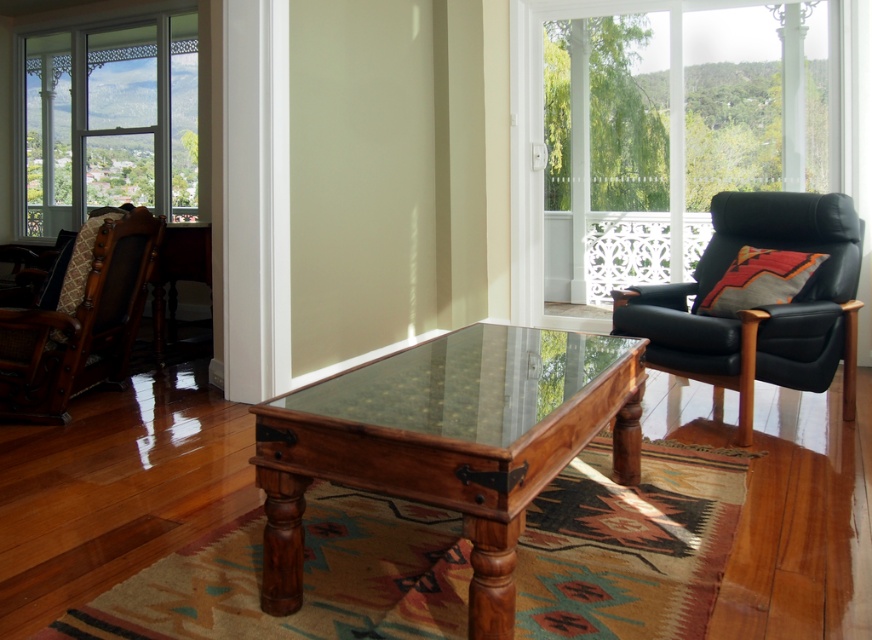
You are a delivery person who needs to place a package on the brown wood table at center. You are currently standing at the clear glass window at upper left. Can you reach the table without moving more than 15 feet? Please explain your reasoning.

The brown wood table at center and clear glass window at upper left are 16.91 feet apart from each other. Since 16.91 feet is greater than 15 feet, you cannot reach the table without moving more than 15 feet.

You are a delivery person who needs to place a package on the brown wood table at center. The package is 5 feet long. Can you walk straight from your current position to the table without moving the package?

The distance between you and the brown wood table at center is 4.82 feet. Since the package is 5 feet long, it cannot be carried straight without tilting or rotating it to fit within the available space.